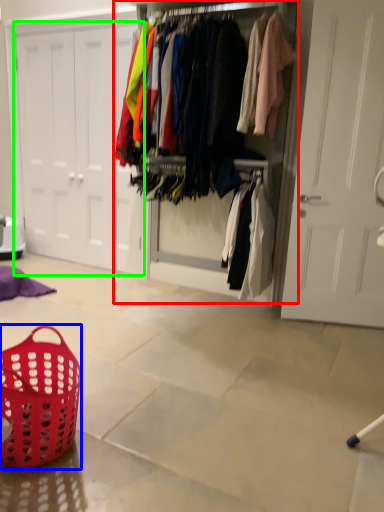
Question: Which object is positioned closest to closet (highlighted by a red box)? Select from basket (highlighted by a blue box) and door (highlighted by a green box).

Choices:
 (A) basket
 (B) door

Answer: (B)